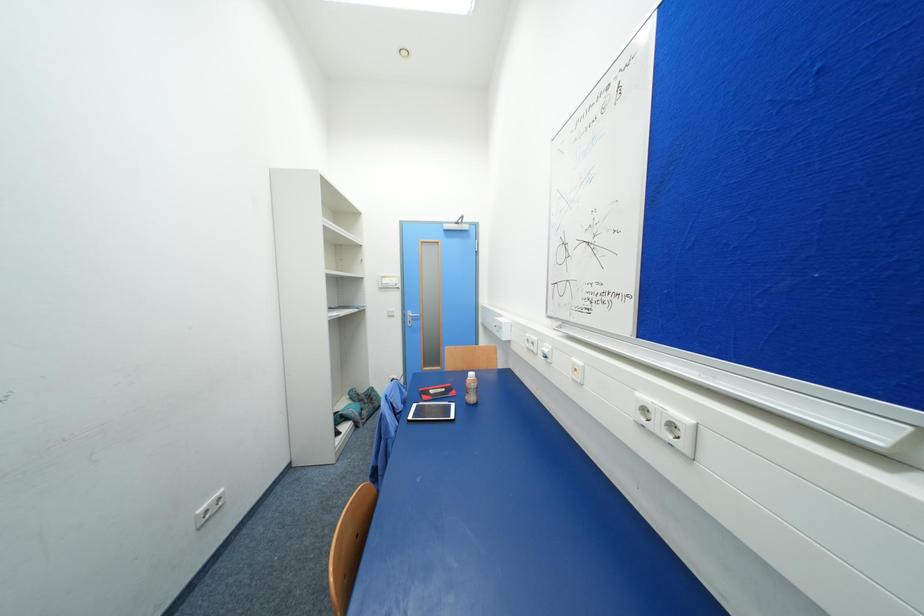
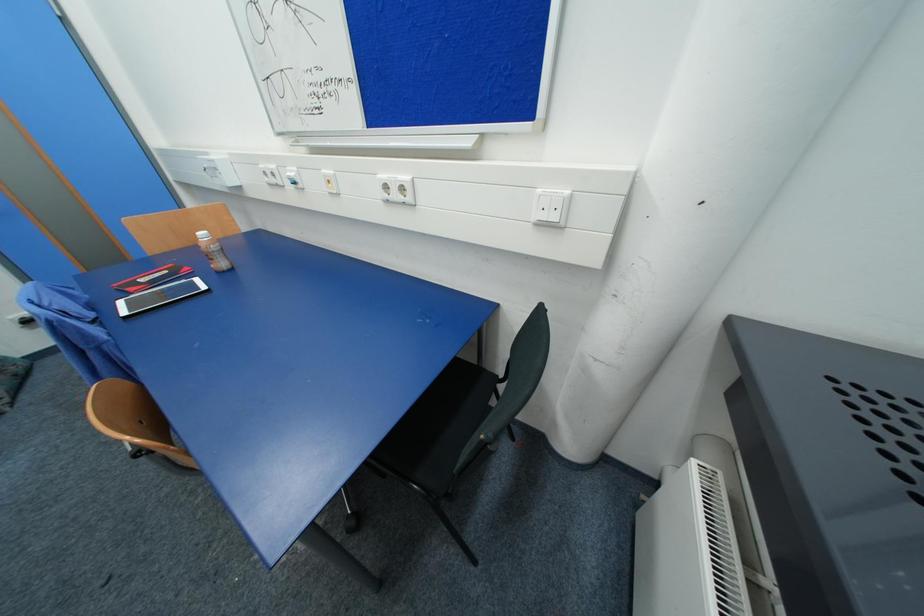
Based on the continuous images, in which direction is the camera rotating?

The camera rotated toward right-down.